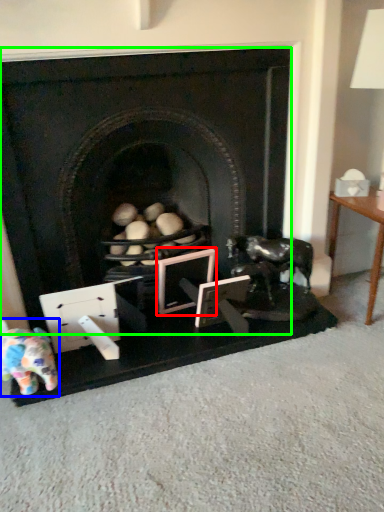
Question: Based on their relative distances, which object is nearer to picture frame (highlighted by a red box)? Choose from toy (highlighted by a blue box) and fireplace (highlighted by a green box).

Choices:
 (A) toy
 (B) fireplace

Answer: (B)